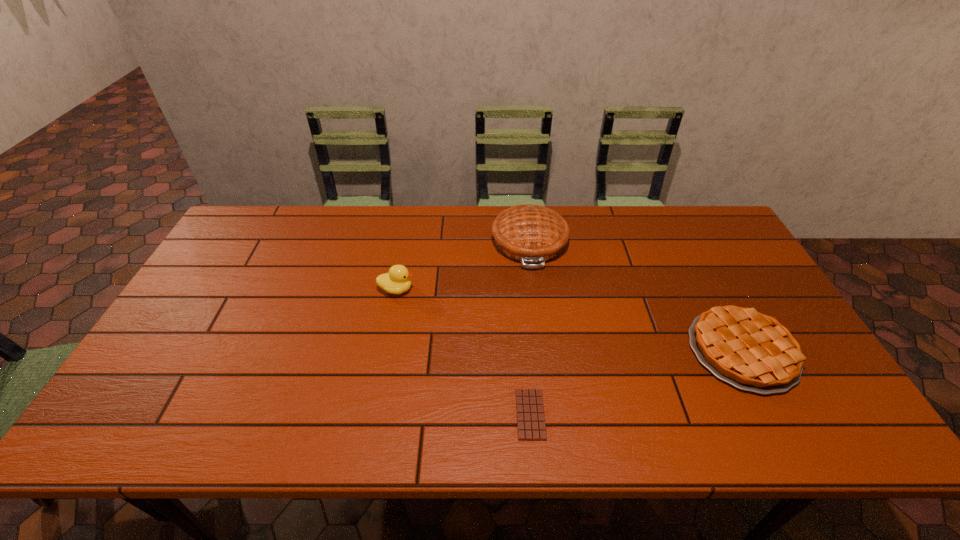
I want to click on object that is the second nearest to the second tallest object, so click(x=531, y=426).

Where is `free space that satisfies the following two spatial constraints: 1. on the beak of the second farthest object; 2. on the left side of the shorter pie`? This screenshot has width=960, height=540. free space that satisfies the following two spatial constraints: 1. on the beak of the second farthest object; 2. on the left side of the shorter pie is located at coordinates (385, 350).

Where is `vacant region that satisfies the following two spatial constraints: 1. on the beak of the leftmost object; 2. on the back side of the shortest object`? This screenshot has width=960, height=540. vacant region that satisfies the following two spatial constraints: 1. on the beak of the leftmost object; 2. on the back side of the shortest object is located at coordinates (372, 414).

Identify the location of vacant position in the image that satisfies the following two spatial constraints: 1. on the front side of the left pie; 2. on the beak of the leftmost object. (536, 289).

You are a GUI agent. You are given a task and a screenshot of the screen. Output one action in this format:
    pyautogui.click(x=<x>, y=<y>)
    Task: Click on the free space that satisfies the following two spatial constraints: 1. on the beak of the shortest object; 2. on the left side of the duckling
    This screenshot has height=540, width=960.
    Given the screenshot: What is the action you would take?
    pyautogui.click(x=372, y=414)